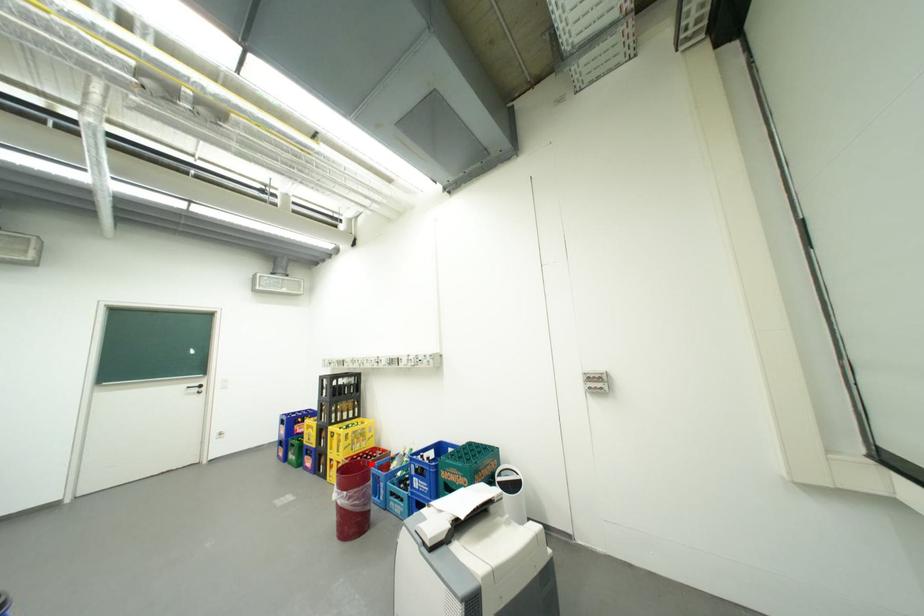
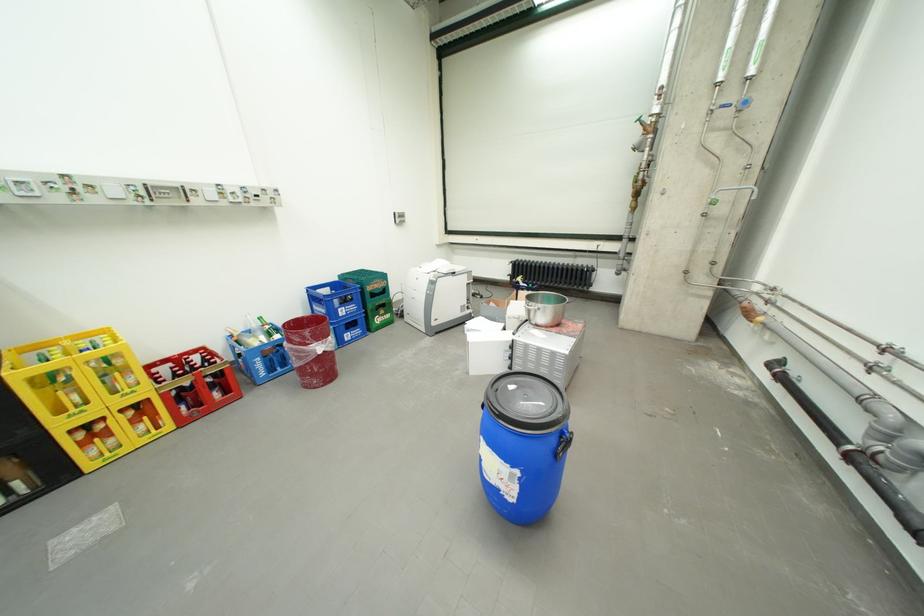
Question: I am providing you with two images of the same scene from different viewpoints. A red point is shown in image1. For the corresponding object point in image2, is it positioned nearer or farther from the camera?

Choices:
 (A) Nearer
 (B) Farther

Answer: (B)